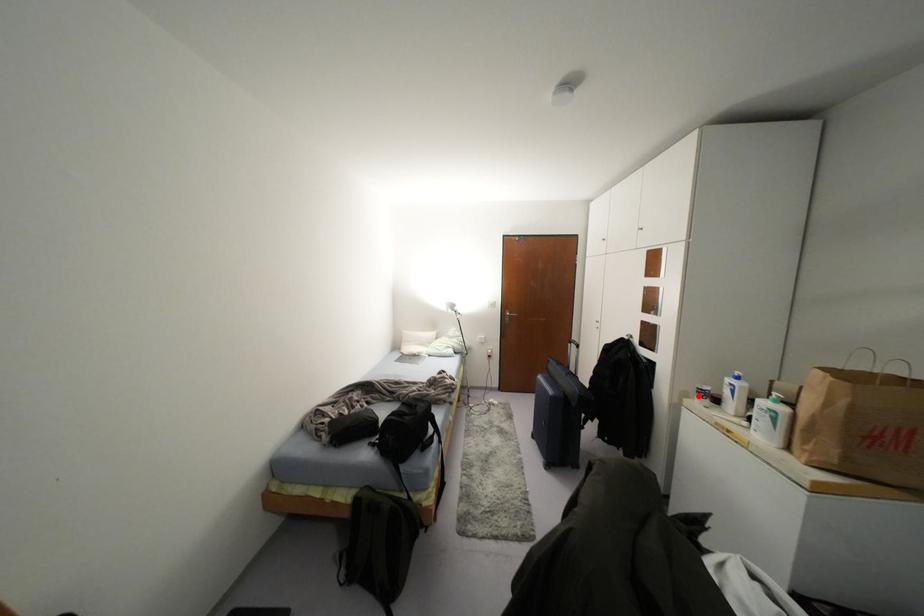
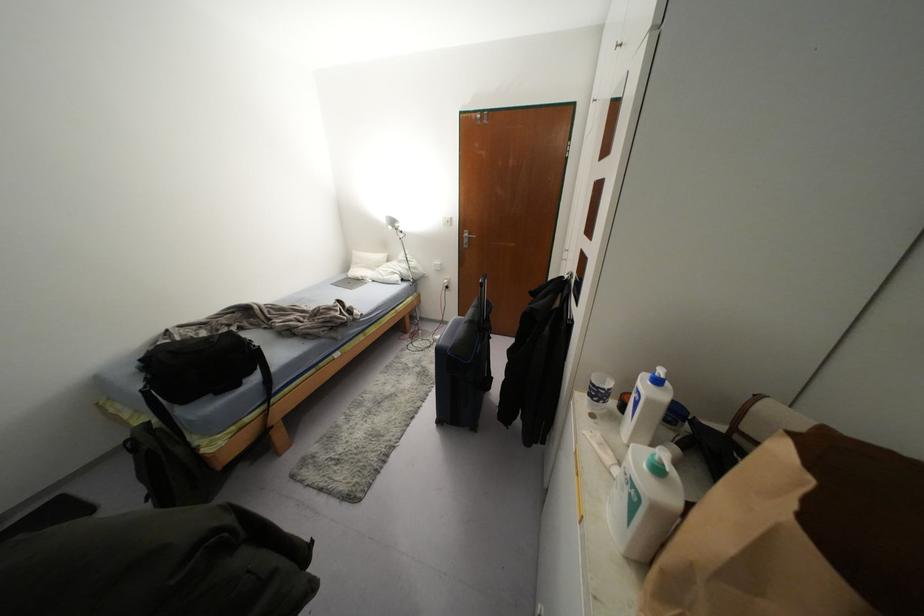
In the second image, find the point that corresponds to the highlighted location in the first image.

(590, 395)